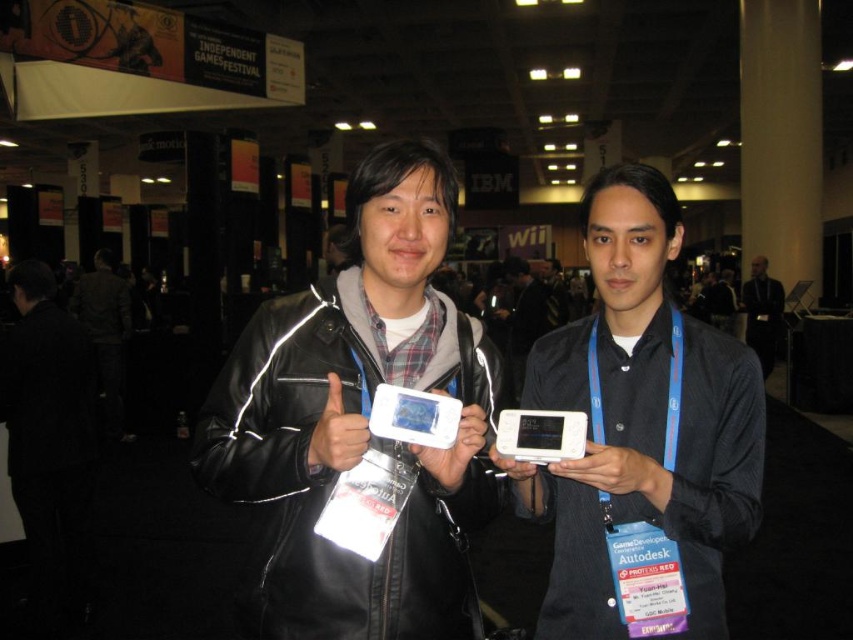
Consider the image. Does black leather jacket at center appear under matte black phone at center?

Indeed, black leather jacket at center is positioned under matte black phone at center.

The height and width of the screenshot is (640, 853). What do you see at coordinates (357, 419) in the screenshot?
I see `black leather jacket at center` at bounding box center [357, 419].

Which is behind, point (440, 628) or point (531, 291)?

The point (531, 291) is more distant.

Where is `black leather jacket at center`? This screenshot has height=640, width=853. black leather jacket at center is located at coordinates (357, 419).

Is black leather jacket at left to the left of dark gray shirt at center from the viewer's perspective?

Yes, black leather jacket at left is to the left of dark gray shirt at center.

Which is more to the left, black leather jacket at left or dark gray shirt at center?

Positioned to the left is black leather jacket at left.

Find the location of a particular element. black leather jacket at left is located at coordinates (106, 333).

Who is shorter, black leather jacket at center or black leather jacket at left?

black leather jacket at center

Can you confirm if black leather jacket at center is thinner than black leather jacket at left?

Indeed, black leather jacket at center has a lesser width compared to black leather jacket at left.

Locate an element on the screen. The image size is (853, 640). black leather jacket at center is located at coordinates (357, 419).